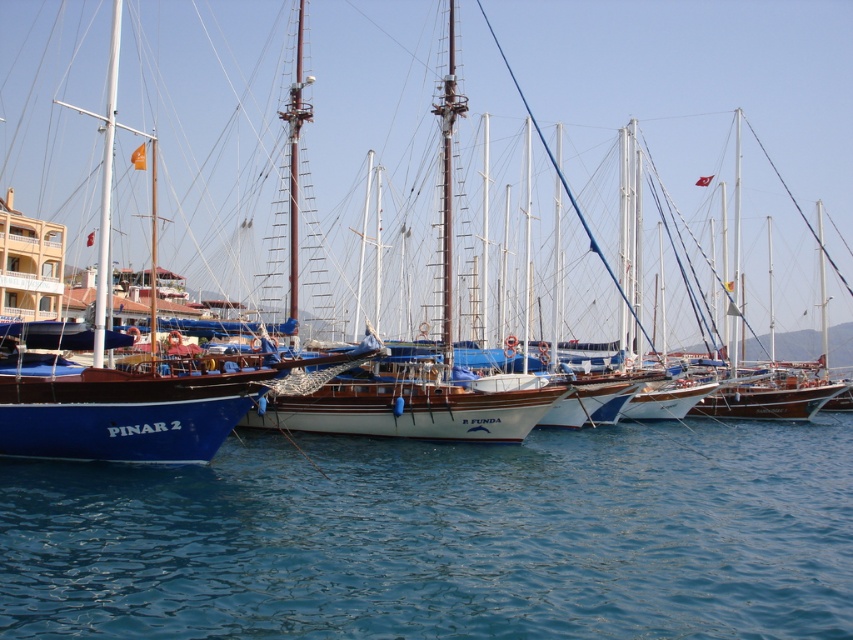
Question: Among these points, which one is farthest from the camera?

Choices:
 (A) [x=231, y=570]
 (B) [x=316, y=212]

Answer: (B)

Question: Does blue polished wood sailboat at left have a greater width compared to blue water at lower left?

Choices:
 (A) yes
 (B) no

Answer: (A)

Question: Considering the relative positions of blue polished wood sailboat at left and blue water at lower left in the image provided, where is blue polished wood sailboat at left located with respect to blue water at lower left?

Choices:
 (A) above
 (B) below

Answer: (A)

Question: Which point is farther to the camera?

Choices:
 (A) (434, 129)
 (B) (428, 524)

Answer: (A)

Question: Is blue polished wood sailboat at left below blue water at lower left?

Choices:
 (A) yes
 (B) no

Answer: (B)

Question: Among these points, which one is nearest to the camera?

Choices:
 (A) (401, 291)
 (B) (529, 579)

Answer: (B)